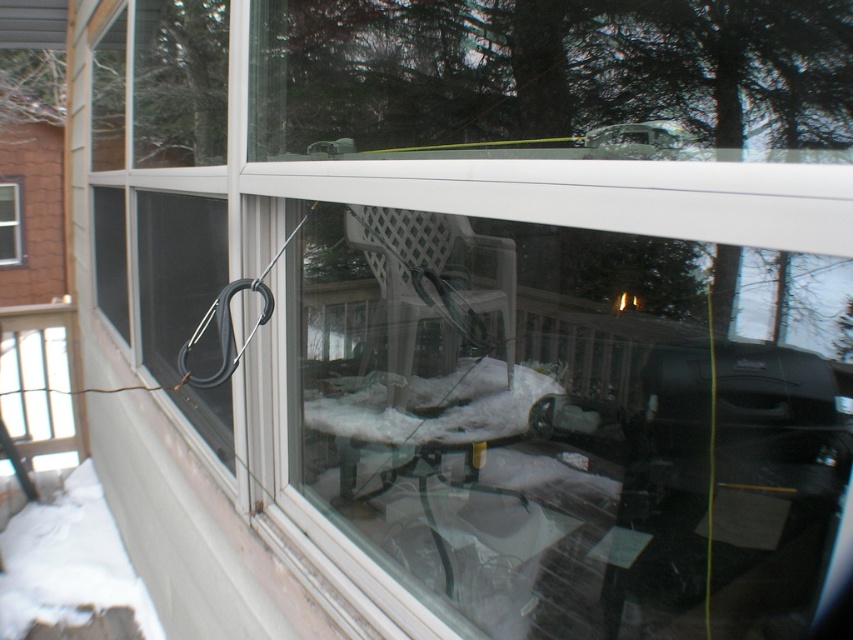
You are standing inside the house looking out the window. You notice the white plastic porch at lower left and the clear glass window at upper left. Which object would block more of your view when looking outside?

The white plastic porch at lower left would block more of your view because it has a larger size compared to the clear glass window at upper left.

What is located at the coordinate point (71, 570) in the image?

The point (71, 570) marks white powdery snow at lower left.

Based on the scene description, where is the white powdery snow at lower left located in the image?

The white powdery snow at lower left is located at point (71, 570) in the image.